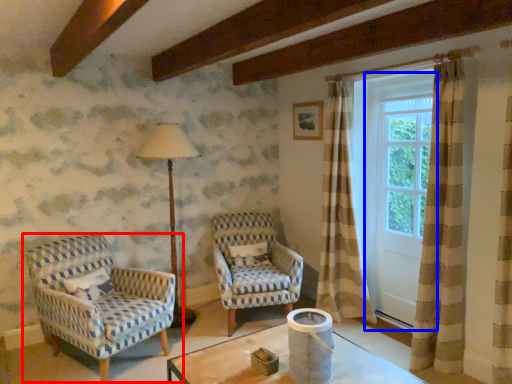
Question: Which point is further to the camera, chair (highlighted by a red box) or screen door (highlighted by a blue box)?

Choices:
 (A) chair
 (B) screen door

Answer: (B)